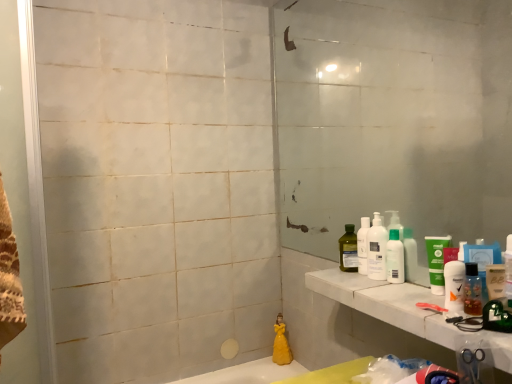
Identify the location of free space above white marble counter top at right (from a real-world perspective). (420, 295).